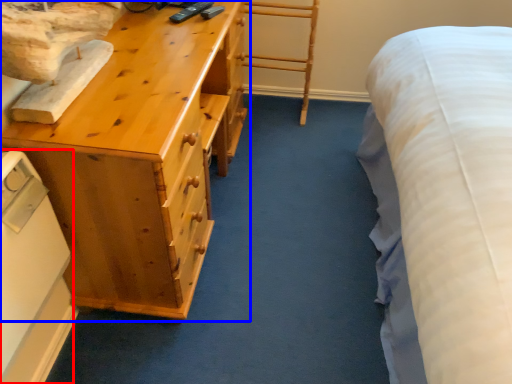
Question: Among these objects, which one is nearest to the camera, appliance (highlighted by a red box) or chest of drawers (highlighted by a blue box)?

Choices:
 (A) appliance
 (B) chest of drawers

Answer: (A)